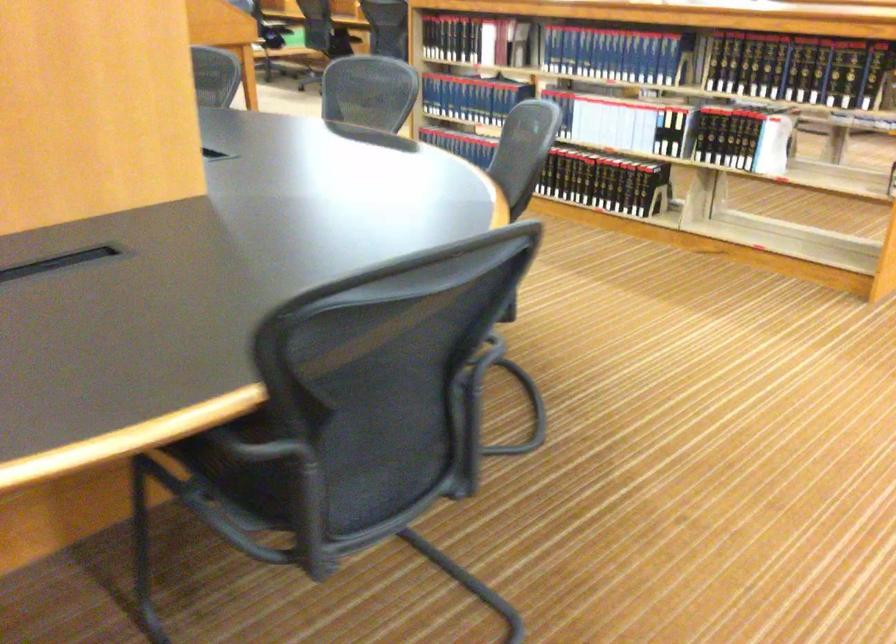
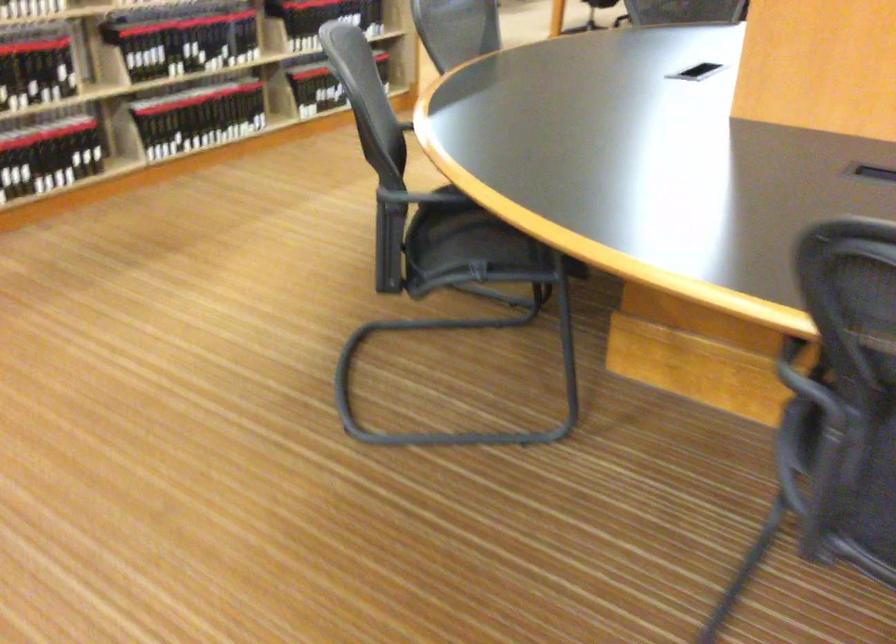
The first image is from the beginning of the video and the second image is from the end. How did the camera likely rotate when shooting the video?

The camera rotated toward left-down.